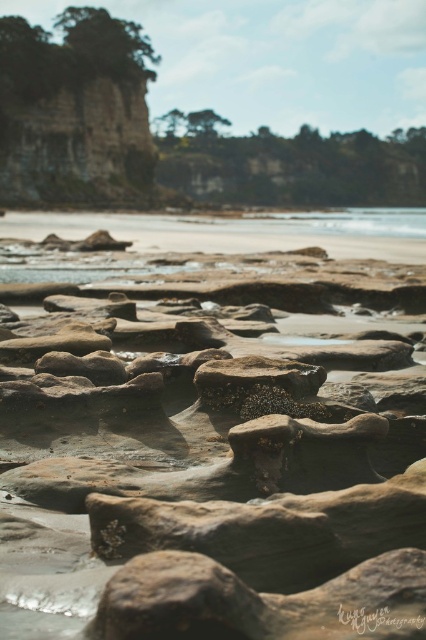
Looking at this image, you are a geologist examining the coastal landscape. You notice the smooth sandstone rock at center and the clear water at center. Which object has a smaller width when viewed from above?

The smooth sandstone rock at center is thinner than the clear water at center, so the smooth sandstone rock at center has a smaller width when viewed from above.

You are standing on the beach and see the smooth sandstone rock at center and the clear water at center. Which object is positioned to the left of the other?

The smooth sandstone rock at center is to the left of clear water at center.

You are standing on the beach and want to place a 100 feet long wooden board between the smooth sandstone rock at center and the clear water at center. Is there enough space to place it without bending the board?

The smooth sandstone rock at center is 187.84 feet from clear water at center. Since the board is 100 feet long, there is enough space to place it without bending the board.